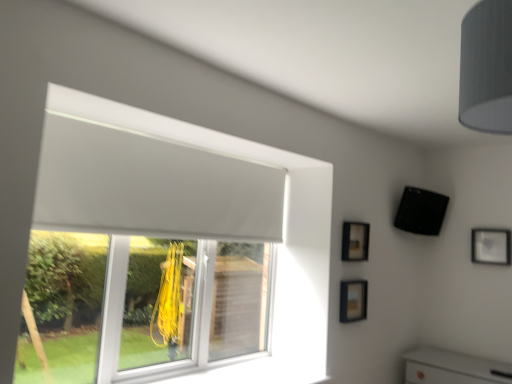
Question: Does matte black picture frame at upper right, positioned as the 1th picture frame in right-to-left order, have a smaller size compared to white matte window at upper left?

Choices:
 (A) yes
 (B) no

Answer: (A)

Question: From a real-world perspective, is matte black picture frame at upper right, positioned as the 1th picture frame in right-to-left order, located beneath white matte window at upper left?

Choices:
 (A) yes
 (B) no

Answer: (B)

Question: From a real-world perspective, is matte black picture frame at upper right, positioned as the 1th picture frame in right-to-left order, located higher than white matte window at upper left?

Choices:
 (A) yes
 (B) no

Answer: (A)

Question: Are matte black picture frame at upper right, positioned as the 1th picture frame in right-to-left order, and white matte window at upper left located far from each other?

Choices:
 (A) yes
 (B) no

Answer: (A)

Question: Is matte black picture frame at upper right, positioned as the third picture frame in front-to-back order, further to camera compared to white matte window at upper left?

Choices:
 (A) yes
 (B) no

Answer: (A)

Question: Can you confirm if matte black picture frame at upper right, positioned as the third picture frame in left-to-right order, is shorter than white matte window at upper left?

Choices:
 (A) yes
 (B) no

Answer: (A)

Question: From the image's perspective, is white matte window at upper left on top of matte black picture frame at lower center, which ranks as the third picture frame in right-to-left order?

Choices:
 (A) no
 (B) yes

Answer: (B)

Question: Can you confirm if white matte window at upper left is wider than matte black picture frame at lower center, marked as the third picture frame in a back-to-front arrangement?

Choices:
 (A) no
 (B) yes

Answer: (B)

Question: Is white matte window at upper left taller than matte black picture frame at lower center, which appears as the 1th picture frame when viewed from the left?

Choices:
 (A) no
 (B) yes

Answer: (B)

Question: Does white matte window at upper left come behind matte black picture frame at lower center, marked as the third picture frame in a back-to-front arrangement?

Choices:
 (A) yes
 (B) no

Answer: (B)

Question: Is white matte window at upper left looking in the opposite direction of matte black picture frame at lower center, which ranks as the 1th picture frame in front-to-back order?

Choices:
 (A) yes
 (B) no

Answer: (B)

Question: Is white matte window at upper left bigger than matte black picture frame at lower center, which appears as the 1th picture frame when viewed from the left?

Choices:
 (A) yes
 (B) no

Answer: (A)

Question: Does gray fabric lampshade at upper right come behind matte black picture frame at upper right, positioned as the third picture frame in left-to-right order?

Choices:
 (A) yes
 (B) no

Answer: (B)